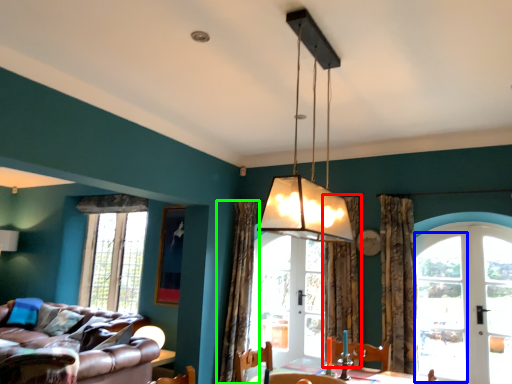
Question: Based on their relative distances, which object is farther from curtain (highlighted by a red box)? Choose from glass door (highlighted by a blue box) and curtain (highlighted by a green box).

Choices:
 (A) glass door
 (B) curtain

Answer: (B)